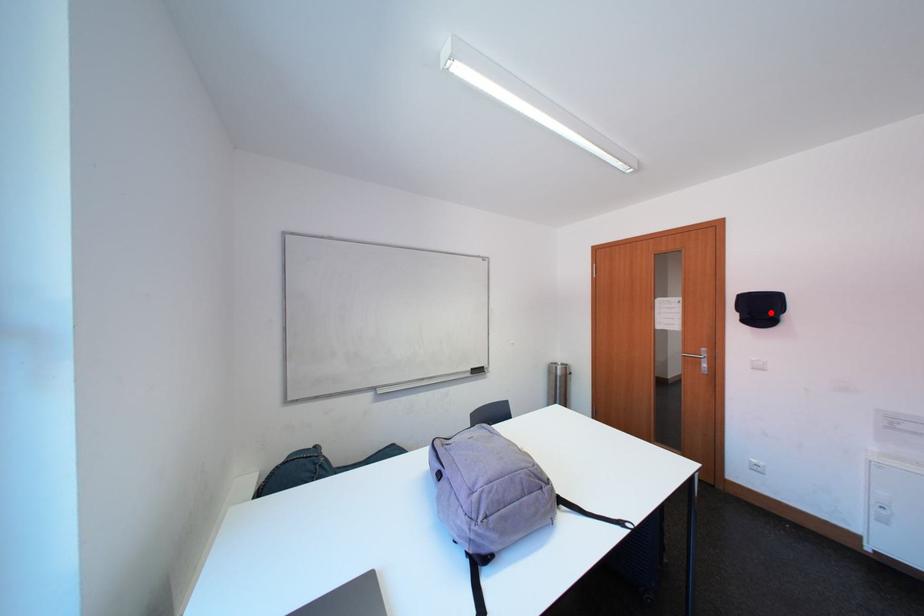
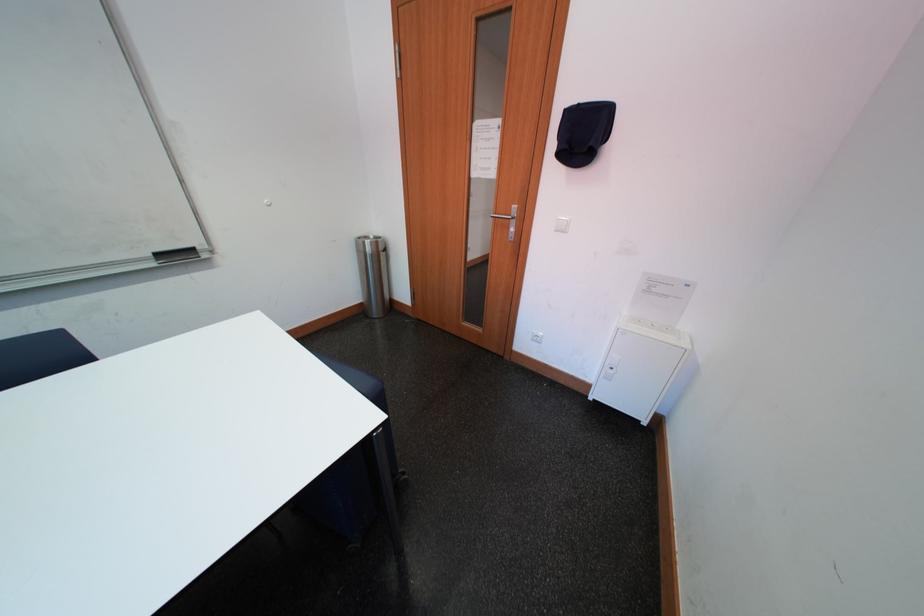
Find the pixel in the second image that matches the highlighted location in the first image.

(593, 140)